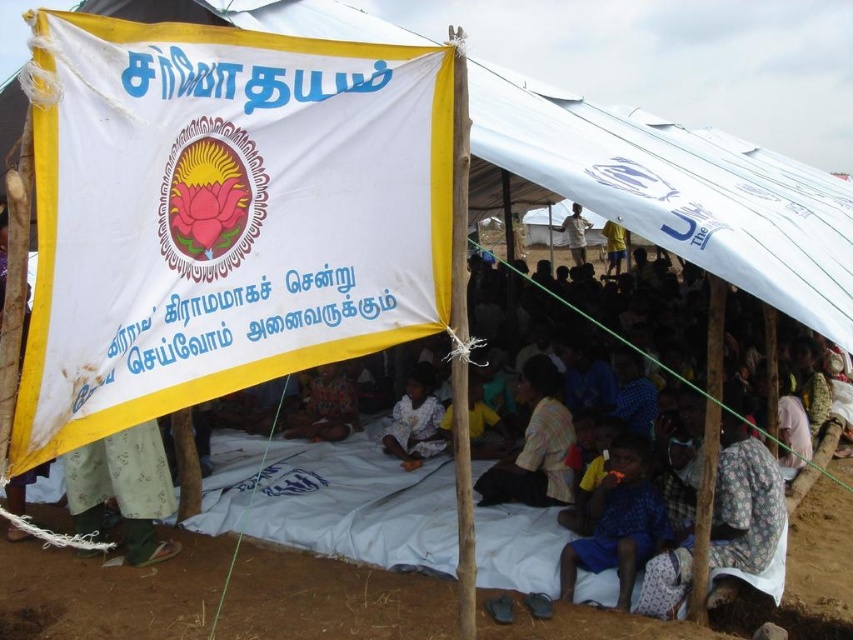
Question: Is floral-patterned fabric at lower right to the right of green fabric skirt at lower left from the viewer's perspective?

Choices:
 (A) no
 (B) yes

Answer: (B)

Question: Among these points, which one is farthest from the camera?

Choices:
 (A) (422, 365)
 (B) (74, 516)
 (C) (677, 605)

Answer: (A)

Question: Can you confirm if floral-patterned fabric at lower right is wider than green fabric skirt at lower left?

Choices:
 (A) no
 (B) yes

Answer: (B)

Question: Does light brown fabric at center appear on the right side of yellow fabric shorts at center?

Choices:
 (A) no
 (B) yes

Answer: (A)

Question: Among these points, which one is farthest from the camera?

Choices:
 (A) (746, 436)
 (B) (318, 426)

Answer: (B)

Question: Estimate the real-world distances between objects in this image. Which object is closer to the light brown wooden pole at center?

Choices:
 (A) white cloth at center
 (B) dark blue fabric at lower center
 (C) yellow fabric shorts at center

Answer: (C)